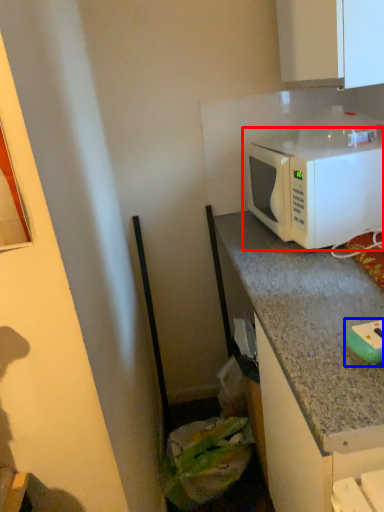
Question: Among these objects, which one is farthest to the camera, microwave oven (highlighted by a red box) or appliance (highlighted by a blue box)?

Choices:
 (A) microwave oven
 (B) appliance

Answer: (A)